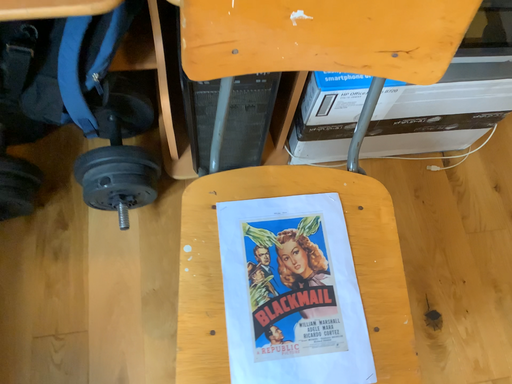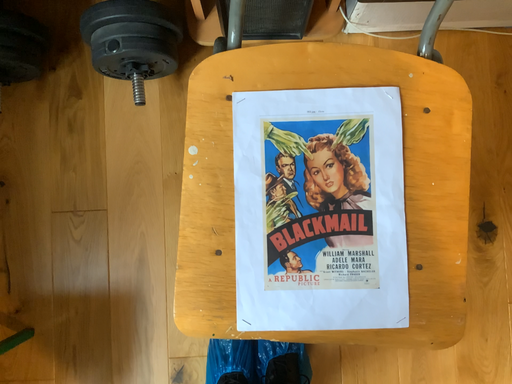
Question: Which way did the camera rotate in the video?

Choices:
 (A) rotated left
 (B) rotated right

Answer: (A)